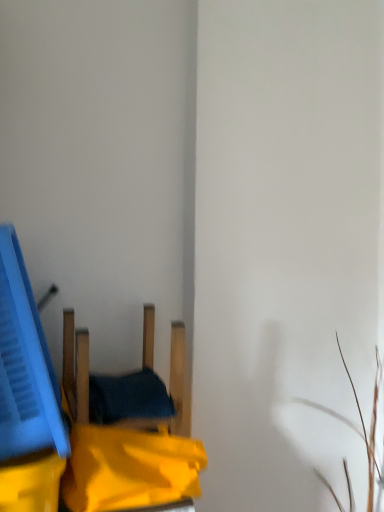
Describe the element at coordinates (75, 368) in the screenshot. I see `wooden chair at center` at that location.

Find the location of a particular element. This screenshot has width=384, height=512. wooden chair at center is located at coordinates (75, 368).

I want to click on blue plastic crate at left, so click(25, 365).

Describe the element at coordinates (25, 365) in the screenshot. This screenshot has height=512, width=384. I see `blue plastic crate at left` at that location.

The height and width of the screenshot is (512, 384). I want to click on wooden chair at center, so point(75,368).

Between wooden chair at center and blue plastic crate at left, which one appears on the right side from the viewer's perspective?

Positioned to the right is wooden chair at center.

Is wooden chair at center further to the viewer compared to blue plastic crate at left?

Yes, the depth of wooden chair at center is greater than that of blue plastic crate at left.

Is point (173, 371) in front of point (7, 339)?

No, it is not.

From the image's perspective, which one is positioned lower, wooden chair at center or blue plastic crate at left?

wooden chair at center.

From a real-world perspective, is wooden chair at center positioned over blue plastic crate at left based on gravity?

Incorrect, from a real-world perspective, wooden chair at center is lower than blue plastic crate at left.

Which object is wider, wooden chair at center or blue plastic crate at left?

blue plastic crate at left is wider.

Who is taller, wooden chair at center or blue plastic crate at left?

blue plastic crate at left.

Considering the relative sizes of wooden chair at center and blue plastic crate at left in the image provided, is wooden chair at center smaller than blue plastic crate at left?

Yes.

Would you say wooden chair at center is outside blue plastic crate at left?

Yes, wooden chair at center is outside of blue plastic crate at left.

Would you consider wooden chair at center to be distant from blue plastic crate at left?

No, wooden chair at center is in close proximity to blue plastic crate at left.

Could you tell me if wooden chair at center is turned towards blue plastic crate at left?

No.

The width and height of the screenshot is (384, 512). In order to click on wide above the wooden chair at center (from the image's perspective) in this screenshot , I will do `click(25, 365)`.

Is blue plastic crate at left to the left of wooden chair at center from the viewer's perspective?

Correct, you'll find blue plastic crate at left to the left of wooden chair at center.

Considering the relative positions of blue plastic crate at left and wooden chair at center in the image provided, is blue plastic crate at left in front of wooden chair at center?

Yes, blue plastic crate at left is closer to the camera.

Which point is more forward, [15,262] or [149,359]?

Positioned in front is point [15,262].

Based on the photo, from the image's perspective, is blue plastic crate at left on wooden chair at center?

Yes, from the image's perspective, blue plastic crate at left is on top of wooden chair at center.

From a real-world perspective, which is physically above, blue plastic crate at left or wooden chair at center?

blue plastic crate at left is physically above.

Can you confirm if blue plastic crate at left is thinner than wooden chair at center?

No, blue plastic crate at left is not thinner than wooden chair at center.

Is blue plastic crate at left shorter than wooden chair at center?

Incorrect, the height of blue plastic crate at left does not fall short of that of wooden chair at center.

Between blue plastic crate at left and wooden chair at center, which one has larger size?

blue plastic crate at left.

Is blue plastic crate at left inside or outside of wooden chair at center?

blue plastic crate at left cannot be found inside wooden chair at center.

Is blue plastic crate at left not near wooden chair at center?

blue plastic crate at left is actually quite close to wooden chair at center.

Does blue plastic crate at left turn towards wooden chair at center?

No, blue plastic crate at left is not aimed at wooden chair at center.

How much distance is there between blue plastic crate at left and wooden chair at center?

blue plastic crate at left and wooden chair at center are 8.00 inches apart.

Where is `furniture on the right of the blue plastic crate at left`? The image size is (384, 512). furniture on the right of the blue plastic crate at left is located at coordinates (75, 368).

You are a GUI agent. You are given a task and a screenshot of the screen. Output one action in this format:
    pyautogui.click(x=<x>, y=<y>)
    Task: Click on the furniture behind the blue plastic crate at left
    
    Given the screenshot: What is the action you would take?
    tap(75, 368)

Locate an element on the screen. The width and height of the screenshot is (384, 512). furniture located below the blue plastic crate at left (from the image's perspective) is located at coordinates tap(75, 368).